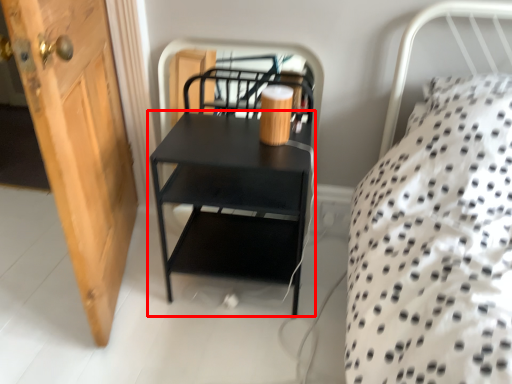
Question: Observing the image, what is the correct spatial positioning of nightstand (annotated by the red box) in reference to door?

Choices:
 (A) left
 (B) right

Answer: (B)